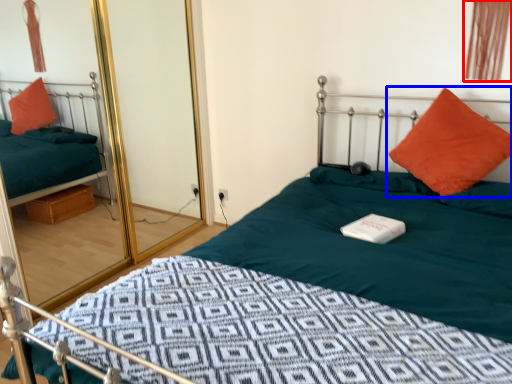
Question: Which object is further to the camera taking this photo, curtain (highlighted by a red box) or pillow (highlighted by a blue box)?

Choices:
 (A) curtain
 (B) pillow

Answer: (A)